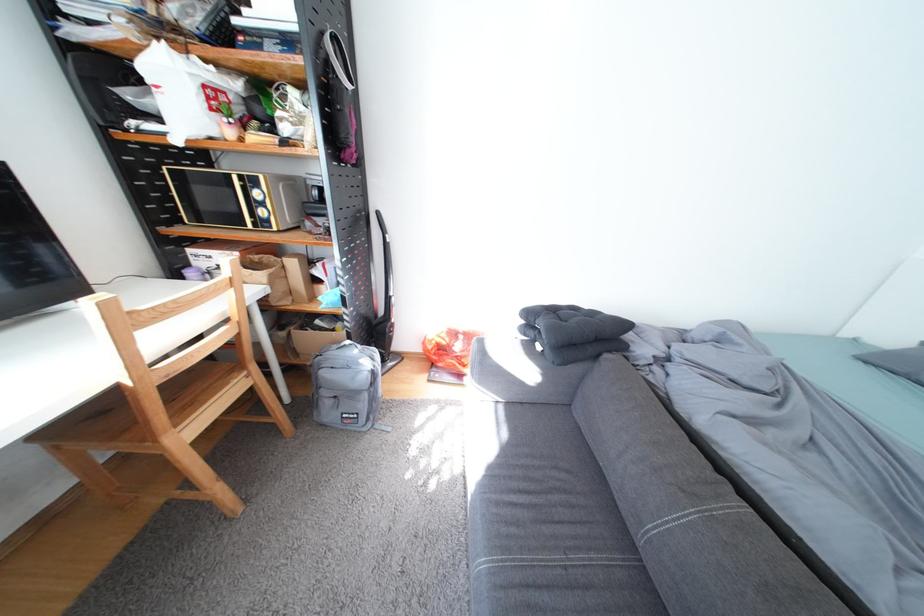
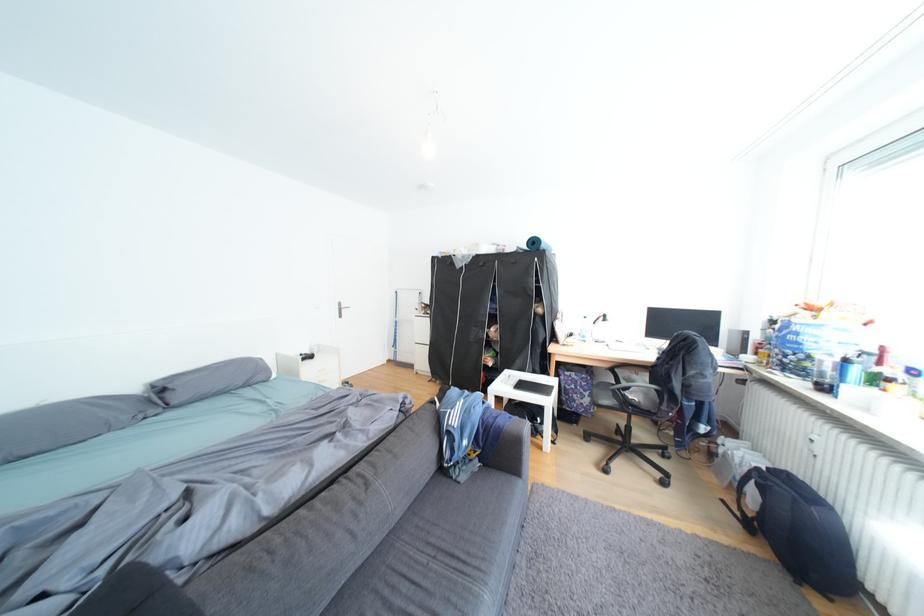
The point at (578, 569) is marked in the first image. Where is the corresponding point in the second image?

(447, 559)